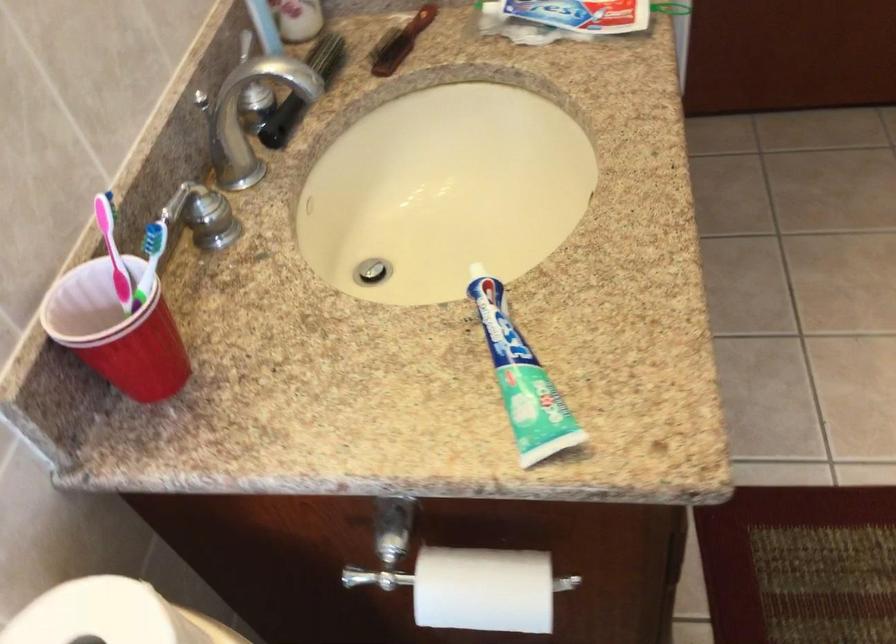
Where would you pull the toilet paper roll? Please return your answer as a coordinate pair (x, y).

(483, 589)